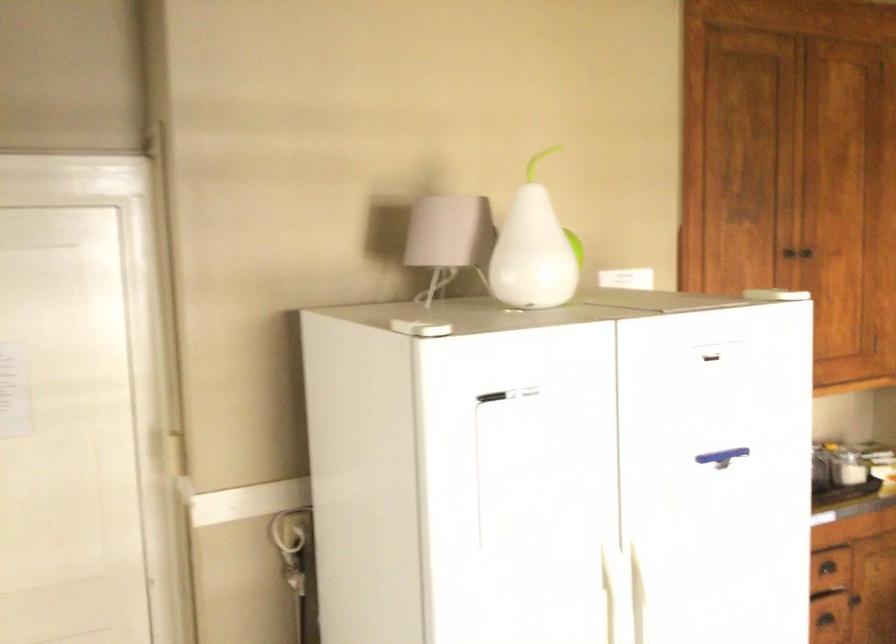
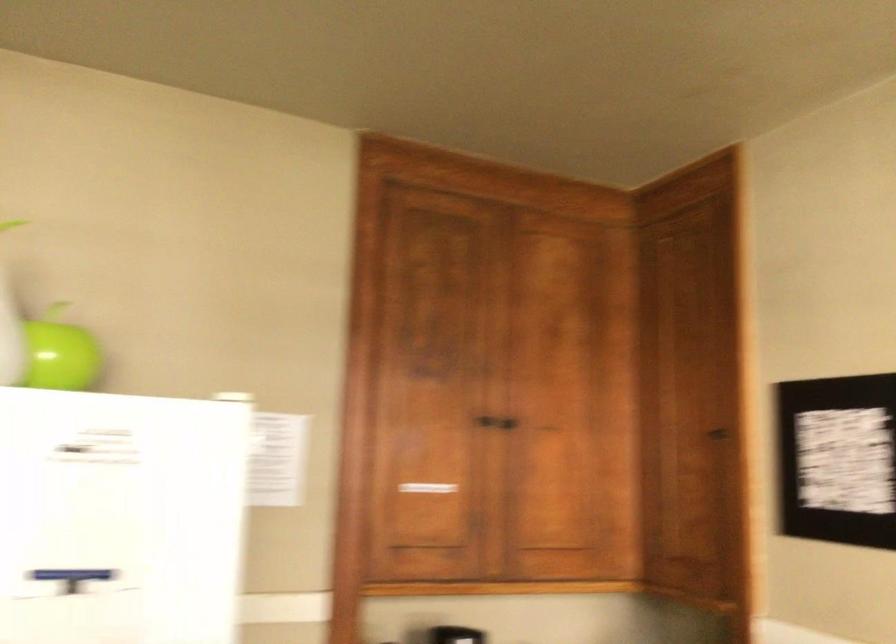
In the second image, find the point that corresponds to (695,458) in the first image.

(72, 574)